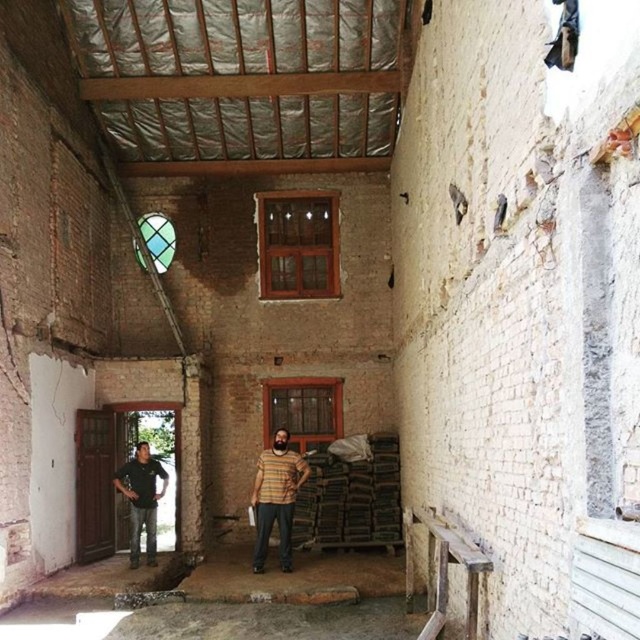
You are an interior designer assessing the space between two people in a construction site. The striped fabric shirt at center and the black cotton shirt at left are standing in the room. Which person is taller?

The striped fabric shirt at center is taller than the black cotton shirt at left.